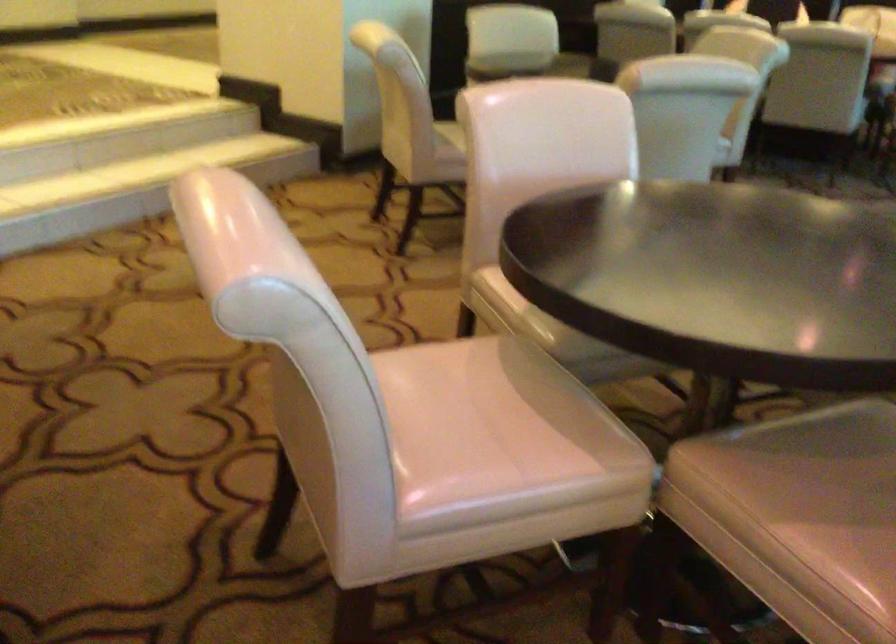
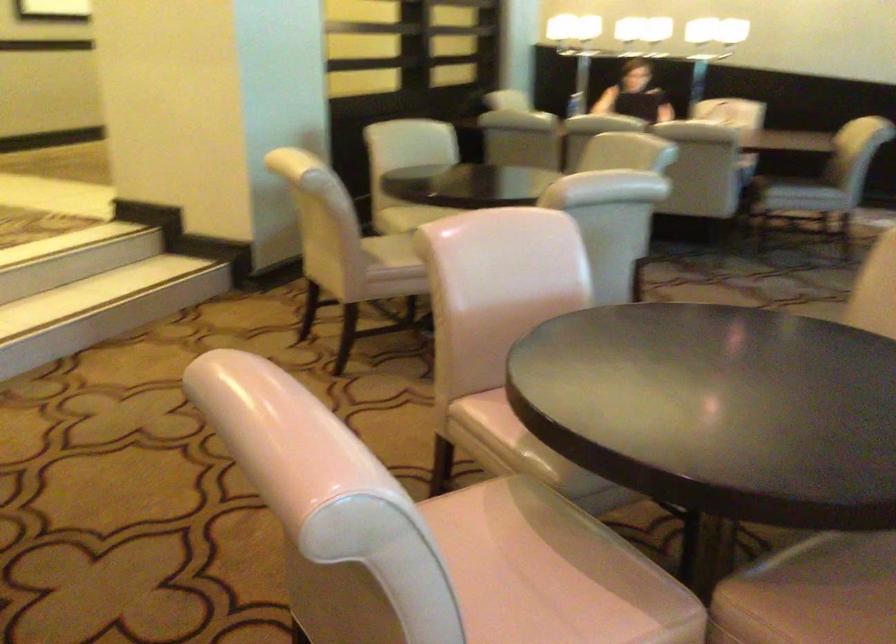
Question: What movement of the cameraman would produce the second image?

Choices:
 (A) Left
 (B) Right
 (C) Forward
 (D) Backward

Answer: (A)